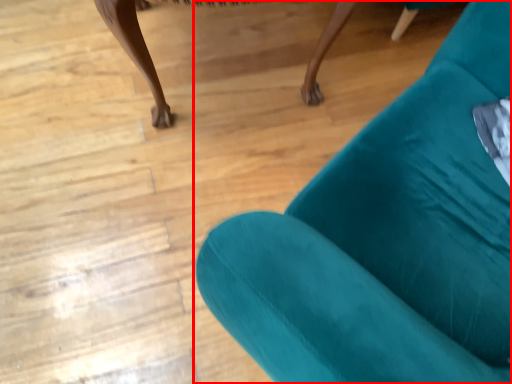
Question: From the image's perspective, considering the relative positions of chair (annotated by the red box) and furniture in the image provided, where is chair (annotated by the red box) located with respect to the staircase?

Choices:
 (A) below
 (B) above

Answer: (A)